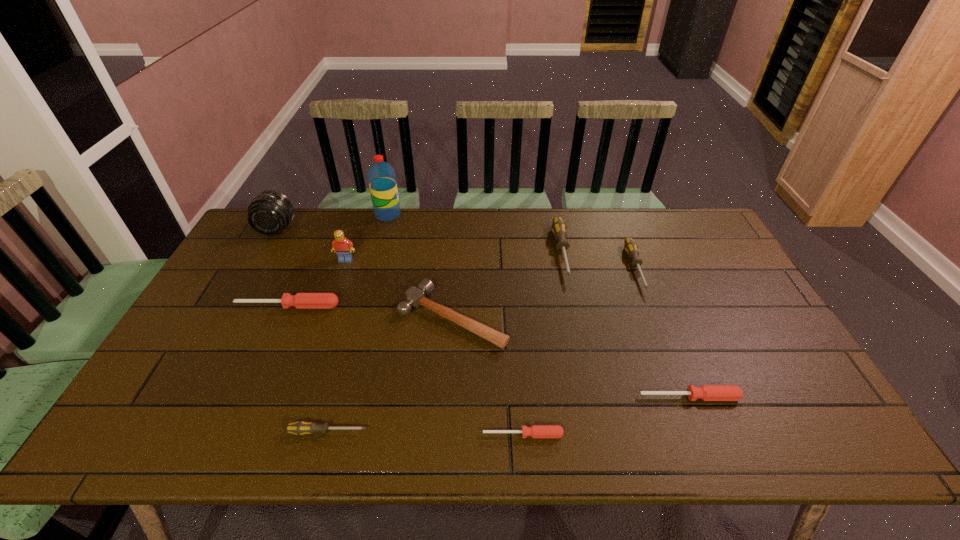
At what (x,y) coordinates should I click in order to perform the action: click on free space between the biggest red screwdriver and the third tallest object. Please return your answer as a coordinate pair (x, y). Image resolution: width=960 pixels, height=540 pixels. Looking at the image, I should click on (317, 283).

Locate an element on the screen. This screenshot has height=540, width=960. free space between the red water bottle and the second gray screwdriver from left to right is located at coordinates (475, 233).

Image resolution: width=960 pixels, height=540 pixels. Identify the location of free space between the biggest red screwdriver and the third tallest object. (317, 283).

Where is `vacant space that's between the telephoto lens and the eighth shortest object`? This screenshot has height=540, width=960. vacant space that's between the telephoto lens and the eighth shortest object is located at coordinates (311, 245).

At what (x,y) coordinates should I click in order to perform the action: click on free space that is in between the third tallest object and the hammer. Please return your answer as a coordinate pair (x, y). The image size is (960, 540). Looking at the image, I should click on (399, 288).

Image resolution: width=960 pixels, height=540 pixels. What are the coordinates of `vacant space in between the hammer and the red water bottle` in the screenshot? It's located at (420, 266).

Find the location of a particular element. This screenshot has width=960, height=540. object that stands as the seventh closest to the red water bottle is located at coordinates (299, 428).

Identify which object is the seventh nearest to the tallest object. Please provide its 2D coordinates. Your answer should be formatted as a tuple, i.e. [(x, y)], where the tuple contains the x and y coordinates of a point satisfying the conditions above.

[(299, 428)]

The width and height of the screenshot is (960, 540). In order to click on screwdriver that can be found as the third closest to the rightmost red screwdriver in this screenshot , I will do [x=558, y=228].

Where is `screwdriver object that ranks as the fifth closest to the hammer`? Image resolution: width=960 pixels, height=540 pixels. screwdriver object that ranks as the fifth closest to the hammer is located at coordinates (706, 392).